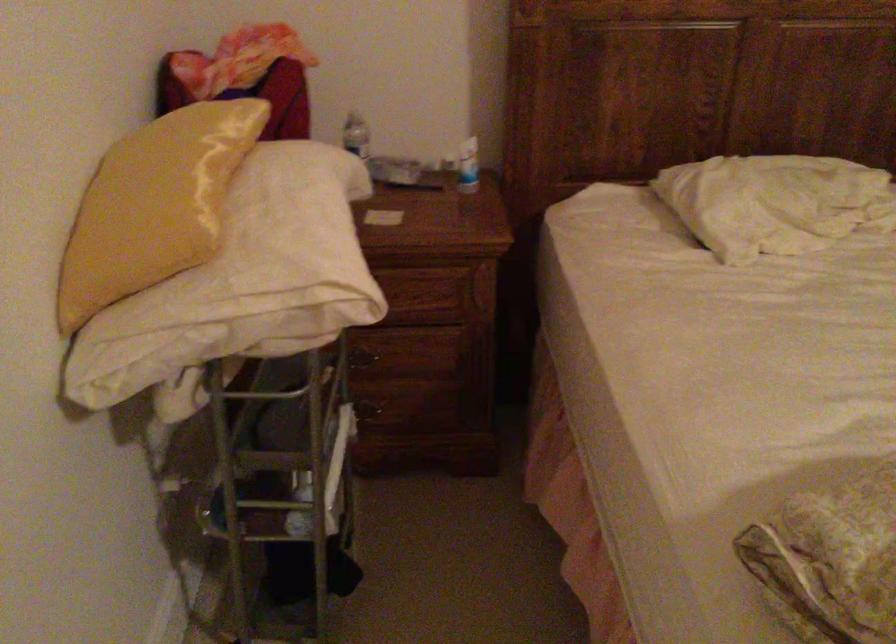
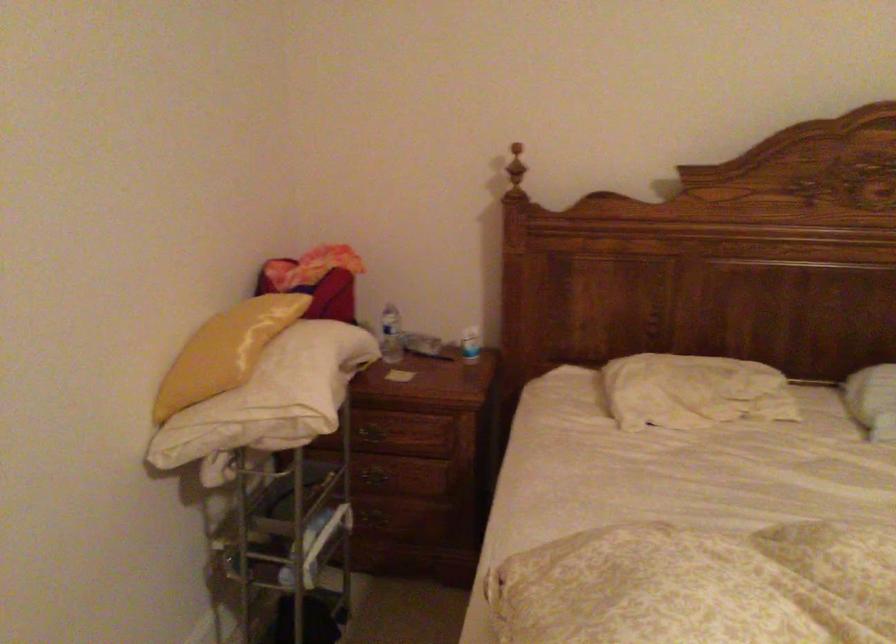
In the second image, find the point that corresponds to pixel 174 201 in the first image.

(225, 351)